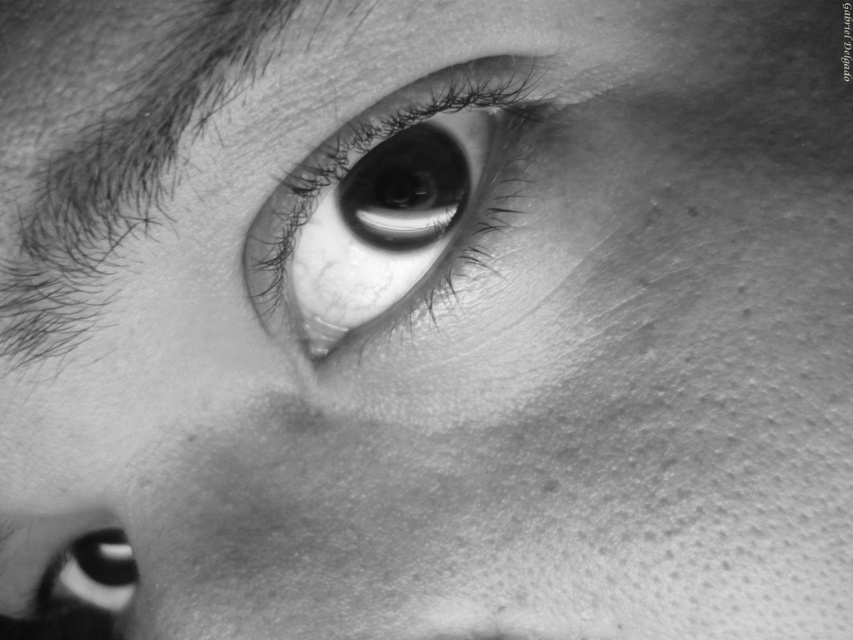
Question: Is smooth skin eye at center closer to camera compared to smooth black eye at lower left?

Choices:
 (A) yes
 (B) no

Answer: (A)

Question: Is smooth skin eye at center above smooth black eye at lower left?

Choices:
 (A) no
 (B) yes

Answer: (B)

Question: Among these objects, which one is nearest to the camera?

Choices:
 (A) smooth skin eye at center
 (B) smooth black eye at lower left

Answer: (A)

Question: Among these points, which one is farthest from the camera?

Choices:
 (A) (360, 209)
 (B) (79, 605)

Answer: (B)

Question: Is smooth skin eye at center positioned before smooth black eye at lower left?

Choices:
 (A) yes
 (B) no

Answer: (A)